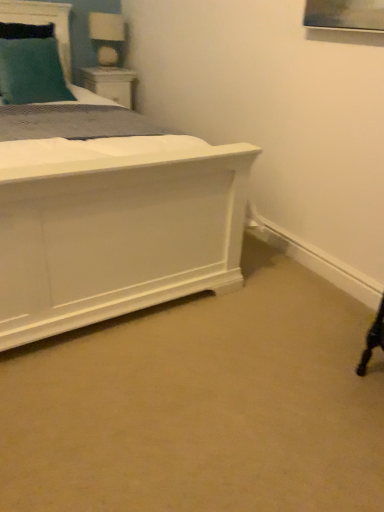
The image size is (384, 512). What do you see at coordinates (43, 23) in the screenshot?
I see `teal fabric headboard at upper left` at bounding box center [43, 23].

Where is `white glossy table lamp at upper left`? The height and width of the screenshot is (512, 384). white glossy table lamp at upper left is located at coordinates (107, 37).

You are a GUI agent. You are given a task and a screenshot of the screen. Output one action in this format:
    pyautogui.click(x=<x>, y=<y>)
    Task: Click on the teal fabric pillow at upper left
    The height and width of the screenshot is (512, 384).
    Given the screenshot: What is the action you would take?
    pyautogui.click(x=31, y=72)

Is teal fabric headboard at upper left located outside white glossy table lamp at upper left?

teal fabric headboard at upper left lies outside white glossy table lamp at upper left's area.

Is teal fabric headboard at upper left looking in the opposite direction of white glossy table lamp at upper left?

teal fabric headboard at upper left is not turned away from white glossy table lamp at upper left.

Can you tell me how much teal fabric headboard at upper left and white glossy table lamp at upper left differ in facing direction?

The angle between the facing direction of teal fabric headboard at upper left and the facing direction of white glossy table lamp at upper left is 1.78 degrees.

Looking at this image, are teal fabric pillow at upper left and teal fabric headboard at upper left making contact?

No, teal fabric pillow at upper left is not beside teal fabric headboard at upper left.

From the image's perspective, which is below, teal fabric pillow at upper left or teal fabric headboard at upper left?

From the image's view, teal fabric pillow at upper left is below.

How distant is teal fabric pillow at upper left from teal fabric headboard at upper left?

The distance of teal fabric pillow at upper left from teal fabric headboard at upper left is 11.25 inches.

Which object is closer to the camera taking this photo, white glossy table lamp at upper left or white wood nightstand at upper left?

white glossy table lamp at upper left.

Would you consider white glossy table lamp at upper left to be distant from white wood nightstand at upper left?

No, white glossy table lamp at upper left is not far away from white wood nightstand at upper left.

Which of these two, white glossy table lamp at upper left or white wood nightstand at upper left, stands shorter?

white wood nightstand at upper left is shorter.

In the image, there is a white glossy table lamp at upper left. Find the location of `nightstand below it (from a real-world perspective)`. nightstand below it (from a real-world perspective) is located at coordinates (109, 83).

Considering the sizes of white wood nightstand at upper left and white glossy table lamp at upper left in the image, is white wood nightstand at upper left bigger or smaller than white glossy table lamp at upper left?

In the image, white wood nightstand at upper left appears to be larger than white glossy table lamp at upper left.

Looking at this image, from the image's perspective, between white wood nightstand at upper left and white glossy table lamp at upper left, which one is located above?

white glossy table lamp at upper left is shown above in the image.

Measure the distance from white wood nightstand at upper left to white glossy table lamp at upper left.

6.99 inches.

Is white wood nightstand at upper left turned away from white glossy table lamp at upper left?

No, white wood nightstand at upper left is not facing the opposite direction of white glossy table lamp at upper left.

How distant is white glossy table lamp at upper left from teal fabric headboard at upper left?

white glossy table lamp at upper left and teal fabric headboard at upper left are 16.34 inches apart from each other.

Can you confirm if white glossy table lamp at upper left is taller than teal fabric headboard at upper left?

No, white glossy table lamp at upper left is not taller than teal fabric headboard at upper left.

Which point is more forward, (103, 16) or (64, 63)?

The point (64, 63) is in front.

Is the depth of white glossy table lamp at upper left greater than that of teal fabric headboard at upper left?

Yes, it is.

Are white glossy table lamp at upper left and teal fabric pillow at upper left located far from each other?

No, white glossy table lamp at upper left is not far away from teal fabric pillow at upper left.

Does white glossy table lamp at upper left have a lesser width compared to teal fabric pillow at upper left?

Yes, white glossy table lamp at upper left is thinner than teal fabric pillow at upper left.

From a real-world perspective, is white glossy table lamp at upper left physically above teal fabric pillow at upper left?

Correct, in the physical world, white glossy table lamp at upper left is higher than teal fabric pillow at upper left.

Is teal fabric headboard at upper left facing away from teal fabric pillow at upper left?

teal fabric headboard at upper left is not turned away from teal fabric pillow at upper left.

Considering the sizes of objects teal fabric headboard at upper left and teal fabric pillow at upper left in the image provided, who is thinner, teal fabric headboard at upper left or teal fabric pillow at upper left?

teal fabric headboard at upper left.

Can teal fabric pillow at upper left be found inside teal fabric headboard at upper left?

That's incorrect, teal fabric pillow at upper left is not inside teal fabric headboard at upper left.

Between teal fabric headboard at upper left and teal fabric pillow at upper left, which one appears on the left side from the viewer's perspective?

teal fabric headboard at upper left.

Find the location of a particular element. The width and height of the screenshot is (384, 512). table lamp lying above the teal fabric headboard at upper left (from the image's perspective) is located at coordinates (107, 37).

The image size is (384, 512). What are the coordinates of `pillow that appears on the right of teal fabric headboard at upper left` in the screenshot? It's located at (31, 72).

When comparing their distances from teal fabric pillow at upper left, does white glossy table lamp at upper left or white wood nightstand at upper left seem closer?

Based on the image, white wood nightstand at upper left appears to be nearer to teal fabric pillow at upper left.

Based on their spatial positions, is teal fabric headboard at upper left or white wood nightstand at upper left further from teal fabric pillow at upper left?

The object further to teal fabric pillow at upper left is white wood nightstand at upper left.

Based on their spatial positions, is teal fabric pillow at upper left or white glossy table lamp at upper left further from white wood nightstand at upper left?

The object further to white wood nightstand at upper left is teal fabric pillow at upper left.

From the image, which object appears to be farther from teal fabric headboard at upper left, teal fabric pillow at upper left or white glossy table lamp at upper left?

The object further to teal fabric headboard at upper left is white glossy table lamp at upper left.

Based on their spatial positions, is white glossy table lamp at upper left or teal fabric pillow at upper left further from teal fabric headboard at upper left?

white glossy table lamp at upper left is further to teal fabric headboard at upper left.

Looking at the image, which one is located further to teal fabric pillow at upper left, teal fabric headboard at upper left or white glossy table lamp at upper left?

white glossy table lamp at upper left lies further to teal fabric pillow at upper left than the other object.

Estimate the real-world distances between objects in this image. Which object is closer to white wood nightstand at upper left, teal fabric headboard at upper left or teal fabric pillow at upper left?

teal fabric headboard at upper left is positioned closer to the anchor white wood nightstand at upper left.

When comparing their distances from teal fabric pillow at upper left, does white wood nightstand at upper left or white glossy table lamp at upper left seem closer?

white wood nightstand at upper left.

Identify the location of table lamp between teal fabric pillow at upper left and white wood nightstand at upper left from front to back. (107, 37).

Locate an element on the screen. nightstand between teal fabric headboard at upper left and white glossy table lamp at upper left from left to right is located at coordinates (109, 83).

I want to click on headboard between teal fabric pillow at upper left and white glossy table lamp at upper left along the z-axis, so [x=43, y=23].

This screenshot has height=512, width=384. What are the coordinates of `headboard between teal fabric pillow at upper left and white wood nightstand at upper left from front to back` in the screenshot? It's located at (43, 23).